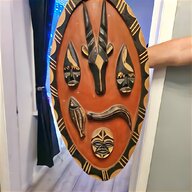
You are a GUI agent. You are given a task and a screenshot of the screen. Output one action in this format:
    pyautogui.click(x=<x>, y=<y>)
    Task: Click on the door frame
    
    Given the screenshot: What is the action you would take?
    pyautogui.click(x=147, y=162)